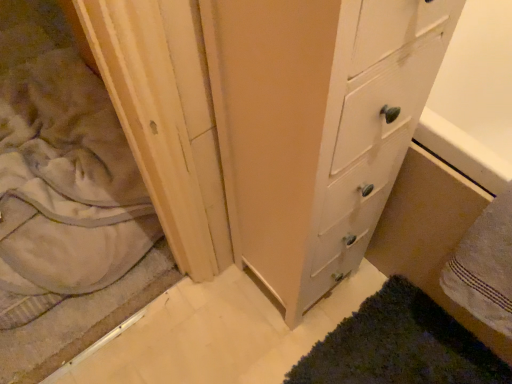
Question: Is there a large distance between beige soft fabric at left and white wood chest of drawers at center?

Choices:
 (A) no
 (B) yes

Answer: (A)

Question: Is the depth of beige soft fabric at left less than that of white wood chest of drawers at center?

Choices:
 (A) no
 (B) yes

Answer: (A)

Question: Does beige soft fabric at left have a lesser height compared to white wood chest of drawers at center?

Choices:
 (A) no
 (B) yes

Answer: (B)

Question: Is beige soft fabric at left placed right next to white wood chest of drawers at center?

Choices:
 (A) no
 (B) yes

Answer: (A)

Question: From a real-world perspective, does beige soft fabric at left sit lower than white wood chest of drawers at center?

Choices:
 (A) yes
 (B) no

Answer: (A)

Question: Is beige soft fabric at left further to the viewer compared to white wood chest of drawers at center?

Choices:
 (A) yes
 (B) no

Answer: (A)

Question: Is white textured towel at lower right in front of beige soft fabric at left?

Choices:
 (A) no
 (B) yes

Answer: (B)

Question: Is white textured towel at lower right to the left of beige soft fabric at left from the viewer's perspective?

Choices:
 (A) yes
 (B) no

Answer: (B)

Question: Is the depth of white textured towel at lower right greater than that of beige soft fabric at left?

Choices:
 (A) no
 (B) yes

Answer: (A)

Question: Would you say beige soft fabric at left is part of white textured towel at lower right's contents?

Choices:
 (A) no
 (B) yes

Answer: (A)

Question: Does white textured towel at lower right have a lesser width compared to beige soft fabric at left?

Choices:
 (A) yes
 (B) no

Answer: (A)

Question: Can you confirm if white textured towel at lower right is taller than beige soft fabric at left?

Choices:
 (A) no
 (B) yes

Answer: (B)

Question: From the image's perspective, is white textured towel at lower right located above white wood chest of drawers at center?

Choices:
 (A) no
 (B) yes

Answer: (A)